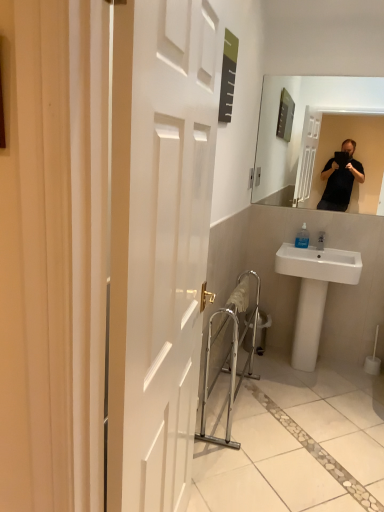
Question: Is metallic silver trash can at center surrounding silver metallic balustrade at lower center?

Choices:
 (A) no
 (B) yes

Answer: (A)

Question: Does metallic silver trash can at center come in front of silver metallic balustrade at lower center?

Choices:
 (A) no
 (B) yes

Answer: (A)

Question: Is metallic silver trash can at center turned away from silver metallic balustrade at lower center?

Choices:
 (A) no
 (B) yes

Answer: (A)

Question: Is metallic silver trash can at center at the left side of silver metallic balustrade at lower center?

Choices:
 (A) yes
 (B) no

Answer: (B)

Question: Is metallic silver trash can at center outside of silver metallic balustrade at lower center?

Choices:
 (A) no
 (B) yes

Answer: (B)

Question: Would you say transparent plastic soap dispenser at sink is to the left or to the right of silver metallic balustrade at lower center in the picture?

Choices:
 (A) right
 (B) left

Answer: (A)

Question: Do you think transparent plastic soap dispenser at sink is within silver metallic balustrade at lower center, or outside of it?

Choices:
 (A) outside
 (B) inside

Answer: (A)

Question: Considering the positions of transparent plastic soap dispenser at sink and silver metallic balustrade at lower center in the image, is transparent plastic soap dispenser at sink taller or shorter than silver metallic balustrade at lower center?

Choices:
 (A) short
 (B) tall

Answer: (A)

Question: From the image's perspective, is transparent plastic soap dispenser at sink above or below silver metallic balustrade at lower center?

Choices:
 (A) above
 (B) below

Answer: (A)

Question: Considering the positions of point (299, 244) and point (258, 334), is point (299, 244) closer or farther from the camera than point (258, 334)?

Choices:
 (A) farther
 (B) closer

Answer: (B)

Question: In the image, is transparent plastic soap dispenser at sink on the left side or the right side of metallic silver trash can at center?

Choices:
 (A) left
 (B) right

Answer: (B)

Question: Choose the correct answer: Is transparent plastic soap dispenser at sink inside metallic silver trash can at center or outside it?

Choices:
 (A) inside
 (B) outside

Answer: (B)

Question: Considering the positions of transparent plastic soap dispenser at sink and metallic silver trash can at center in the image, is transparent plastic soap dispenser at sink taller or shorter than metallic silver trash can at center?

Choices:
 (A) tall
 (B) short

Answer: (B)

Question: Is point (233, 344) positioned closer to the camera than point (302, 365)?

Choices:
 (A) farther
 (B) closer

Answer: (B)

Question: Is silver metallic balustrade at lower center in front of or behind white ceramic sink at lower right in the image?

Choices:
 (A) front
 (B) behind

Answer: (A)